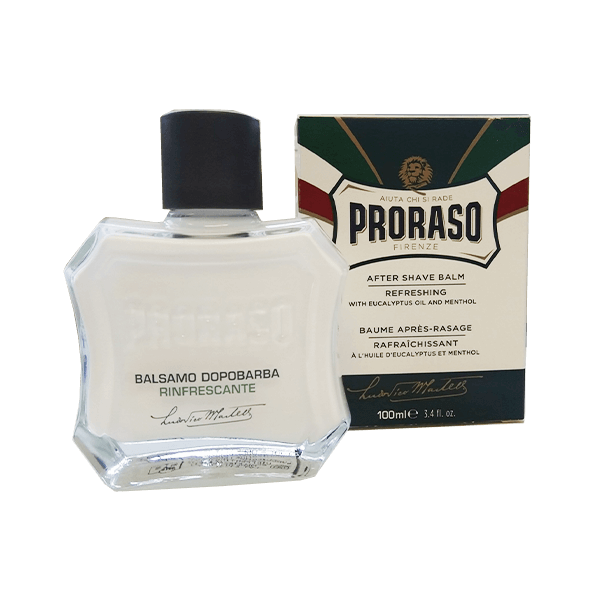
The height and width of the screenshot is (600, 600). I want to click on perfume, so point(287,307).